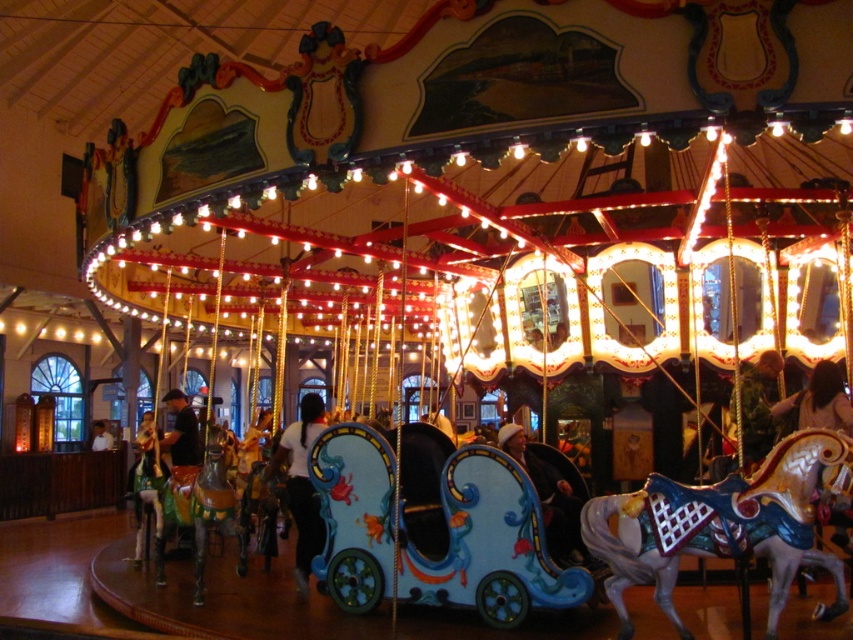
Question: Can you confirm if shiny metallic horse at center is positioned above shiny gold horse at center?

Choices:
 (A) yes
 (B) no

Answer: (B)

Question: Does shiny metallic horse at center appear on the right side of shiny gold horse at center?

Choices:
 (A) yes
 (B) no

Answer: (A)

Question: Which object appears closest to the camera in this image?

Choices:
 (A) shiny gold horse at center
 (B) shiny metallic horse at center

Answer: (B)

Question: Is shiny metallic horse at center smaller than shiny gold horse at center?

Choices:
 (A) no
 (B) yes

Answer: (B)